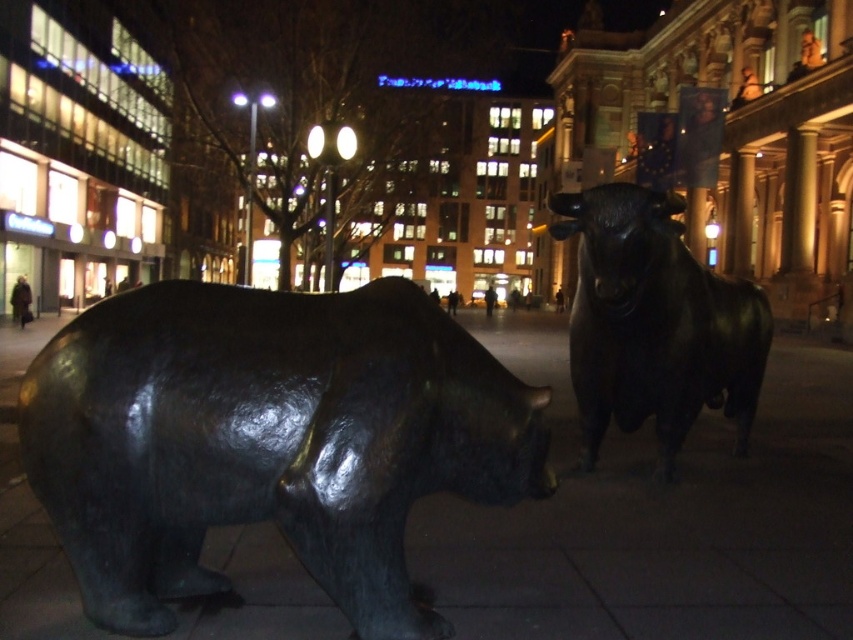
Who is lower down, shiny bronze bear at left or shiny black bull at center?

shiny bronze bear at left is below.

Who is positioned more to the left, shiny bronze bear at left or shiny black bull at center?

shiny bronze bear at left is more to the left.

Describe the element at coordinates (267, 440) in the screenshot. The width and height of the screenshot is (853, 640). I see `shiny bronze bear at left` at that location.

You are a GUI agent. You are given a task and a screenshot of the screen. Output one action in this format:
    pyautogui.click(x=<x>, y=<y>)
    Task: Click on the shiny bronze bear at left
    
    Given the screenshot: What is the action you would take?
    pyautogui.click(x=267, y=440)